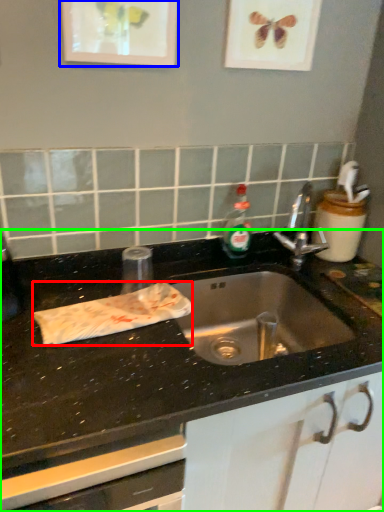
Question: Estimate the real-world distances between objects in this image. Which object is closer to material (highlighted by a red box), picture frame (highlighted by a blue box) or countertop (highlighted by a green box)?

Choices:
 (A) picture frame
 (B) countertop

Answer: (B)